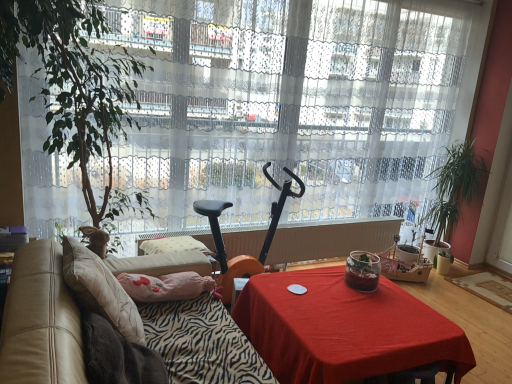
Question: Is the surface of green leafy plant at right, the 1th houseplant viewed from the back, in direct contact with leather at left?

Choices:
 (A) yes
 (B) no

Answer: (B)

Question: Is green leafy plant at right, the 1th houseplant viewed from the back, positioned beyond the bounds of leather at left?

Choices:
 (A) no
 (B) yes

Answer: (B)

Question: From the image's perspective, is green leafy plant at right, the 2th houseplant in the front-to-back sequence, under leather at left?

Choices:
 (A) no
 (B) yes

Answer: (A)

Question: Is green leafy plant at right, the first houseplant in the right-to-left sequence, shorter than leather at left?

Choices:
 (A) no
 (B) yes

Answer: (A)

Question: Considering the relative positions of green leafy plant at right, the 1th houseplant viewed from the back, and leather at left in the image provided, is green leafy plant at right, the 1th houseplant viewed from the back, to the right of leather at left from the viewer's perspective?

Choices:
 (A) yes
 (B) no

Answer: (A)

Question: From their relative heights in the image, would you say beige fabric pillow at left is taller or shorter than white sheer curtain at center?

Choices:
 (A) short
 (B) tall

Answer: (A)

Question: In the image, is beige fabric pillow at left positioned in front of or behind white sheer curtain at center?

Choices:
 (A) front
 (B) behind

Answer: (A)

Question: Considering the relative positions of beige fabric pillow at left and white sheer curtain at center in the image provided, is beige fabric pillow at left to the left or to the right of white sheer curtain at center?

Choices:
 (A) left
 (B) right

Answer: (A)

Question: Is beige fabric pillow at left inside the boundaries of white sheer curtain at center, or outside?

Choices:
 (A) outside
 (B) inside

Answer: (A)

Question: Is point (203, 296) positioned closer to the camera than point (169, 367)?

Choices:
 (A) farther
 (B) closer

Answer: (A)

Question: Visually, is leather at left positioned to the left or to the right of zebra-patterned fabric at lower left?

Choices:
 (A) right
 (B) left

Answer: (B)

Question: Is leather at left taller or shorter than zebra-patterned fabric at lower left?

Choices:
 (A) short
 (B) tall

Answer: (B)

Question: From a real-world perspective, relative to zebra-patterned fabric at lower left, is leather at left vertically above or below?

Choices:
 (A) above
 (B) below

Answer: (B)

Question: Would you say black plastic mobility scooter at center is inside or outside white sheer curtain at center?

Choices:
 (A) inside
 (B) outside

Answer: (B)

Question: Is black plastic mobility scooter at center to the left or to the right of white sheer curtain at center in the image?

Choices:
 (A) left
 (B) right

Answer: (A)